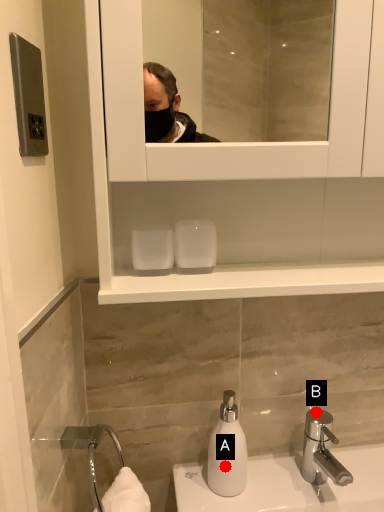
Question: Two points are circled on the image, labeled by A and B beside each circle. Which of the following is the farthest from the observer?

Choices:
 (A) A is further
 (B) B is further

Answer: (B)